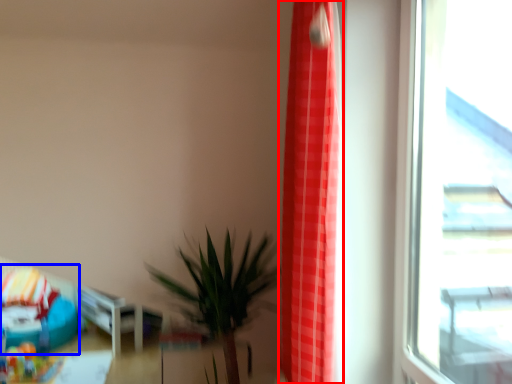
Question: Which object is further to the camera taking this photo, curtain (highlighted by a red box) or bean bag chair (highlighted by a blue box)?

Choices:
 (A) curtain
 (B) bean bag chair

Answer: (B)